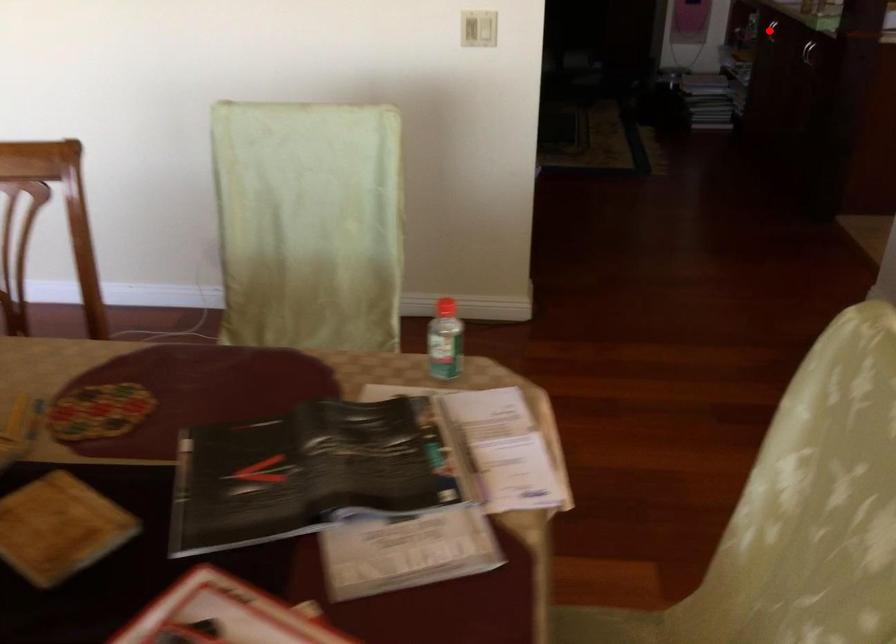
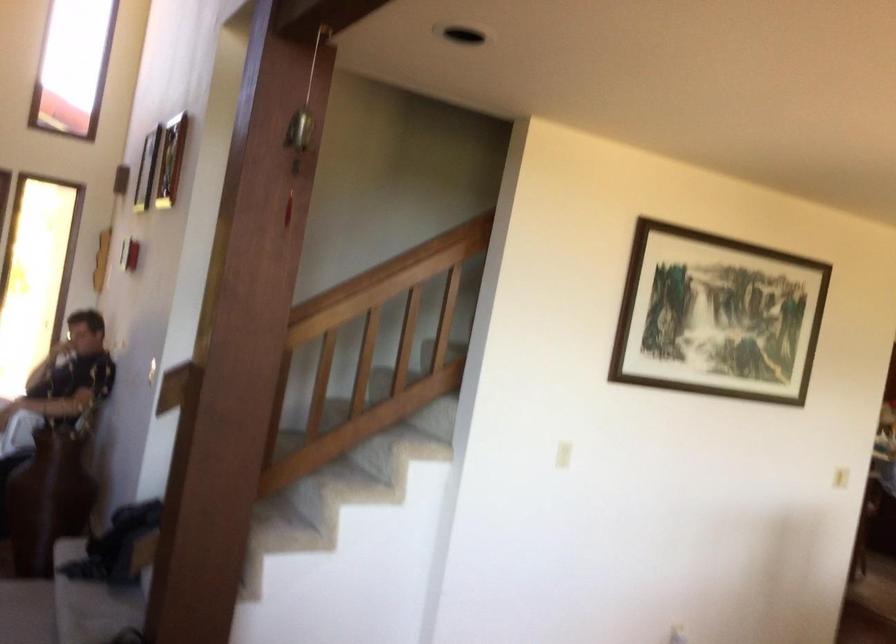
Question: I am providing you with two images of the same scene from different viewpoints. A red point is marked on the first image. Is the red point's position out of view in image 2?

Choices:
 (A) Yes
 (B) No

Answer: (A)